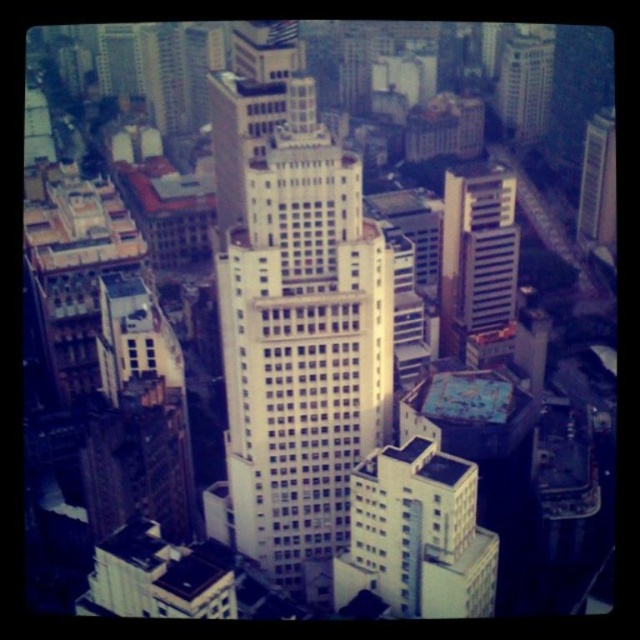
Question: Which is nearer to the white glossy building at upper right?

Choices:
 (A) white glass building at center
 (B) white smooth building at center

Answer: (A)

Question: Among these points, which one is nearest to the camera?

Choices:
 (A) (513, 81)
 (B) (406, 490)

Answer: (B)

Question: Does white smooth building at center have a smaller size compared to white glossy building at upper right?

Choices:
 (A) no
 (B) yes

Answer: (A)

Question: Can you confirm if white smooth building at center is positioned to the left of white glass building at center?

Choices:
 (A) yes
 (B) no

Answer: (A)

Question: Is white smooth building at center further to the viewer compared to white glossy building at upper right?

Choices:
 (A) no
 (B) yes

Answer: (A)

Question: Which object is positioned closest to the white smooth building at center?

Choices:
 (A) white glossy building at upper right
 (B) metallic glass skyscraper at upper right
 (C) white glass building at center

Answer: (C)